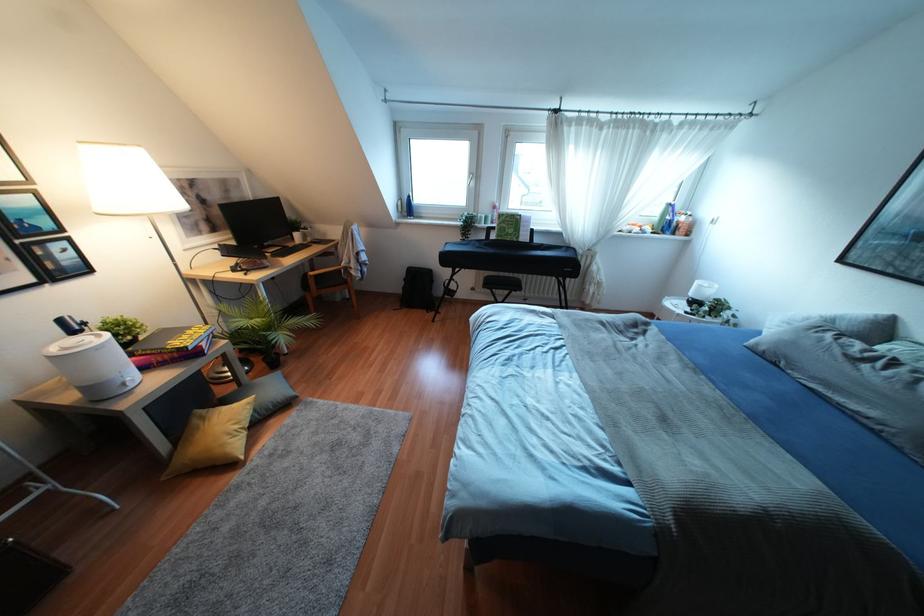
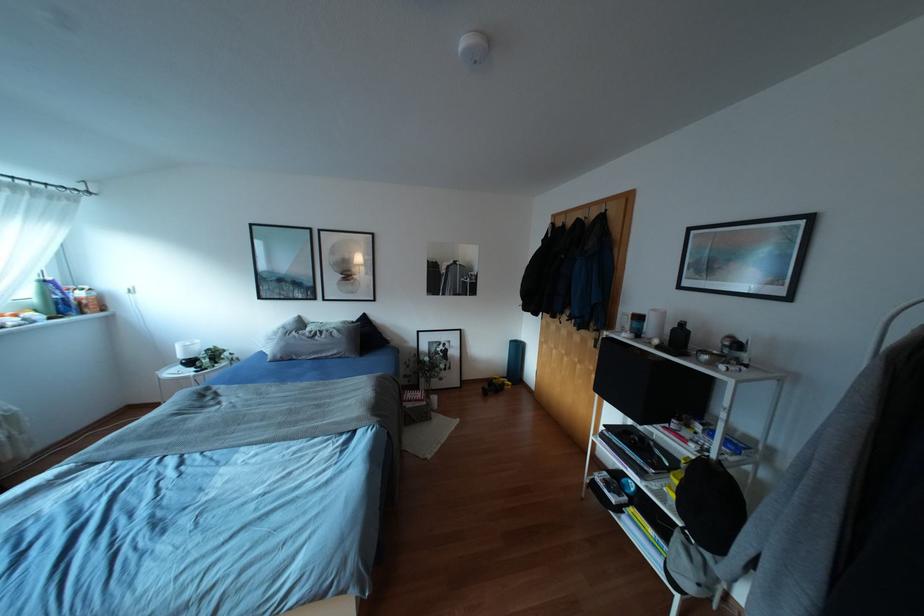
Locate, in the second image, the point that corresponds to (864,366) in the first image.

(315, 338)